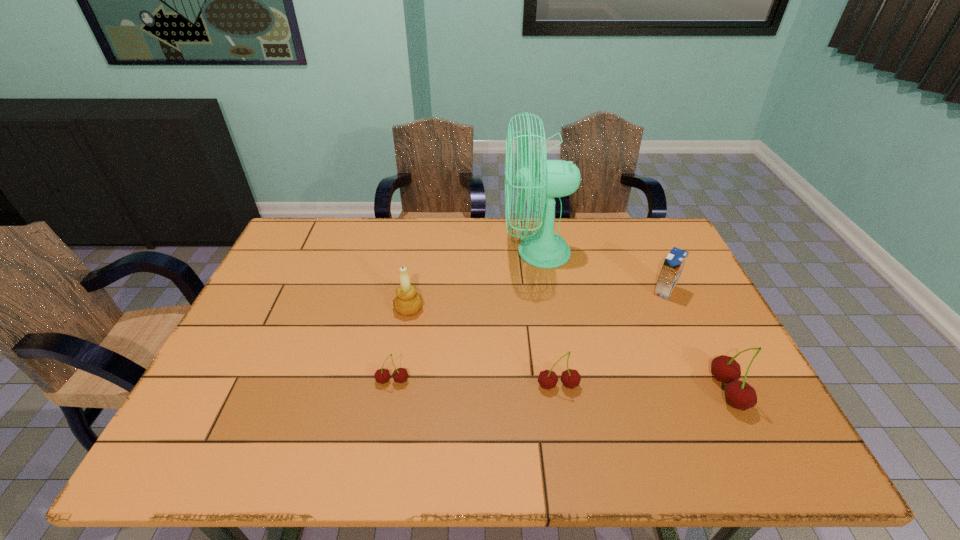
You are a GUI agent. You are given a task and a screenshot of the screen. Output one action in this format:
    pyautogui.click(x=<x>, y=<y>)
    Task: Click on the shortest object
    The width and height of the screenshot is (960, 540).
    Given the screenshot: What is the action you would take?
    pyautogui.click(x=400, y=375)

This screenshot has width=960, height=540. I want to click on the leftmost cherry, so click(x=400, y=375).

The image size is (960, 540). Find the location of `the second shortest cherry`. the second shortest cherry is located at coordinates (570, 378).

Image resolution: width=960 pixels, height=540 pixels. Identify the location of the tallest cherry. (740, 395).

Locate an element on the screen. The image size is (960, 540). the tallest object is located at coordinates (545, 249).

I want to click on candle_holder, so click(408, 302).

Where is `orange_juice`? orange_juice is located at coordinates (674, 262).

The height and width of the screenshot is (540, 960). What are the coordinates of `vacant region located 0.070m on the surface of the second cherry from right to left` in the screenshot? It's located at (564, 421).

Identify the location of free space located 0.290m on the surface of the tallest cherry. (590, 391).

Identify the location of vacant space located 0.290m on the surface of the tallest cherry. (590, 391).